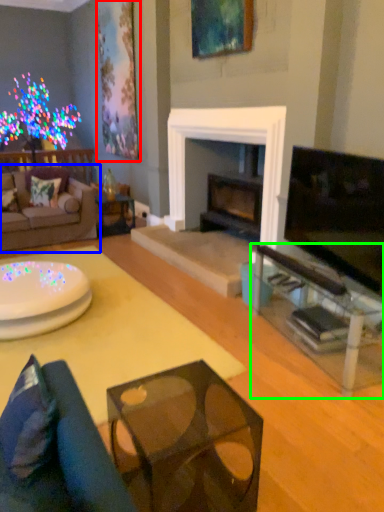
Question: Which is farther away from picture frame (highlighted by a red box)? studio couch (highlighted by a blue box) or table (highlighted by a green box)?

Choices:
 (A) studio couch
 (B) table

Answer: (B)